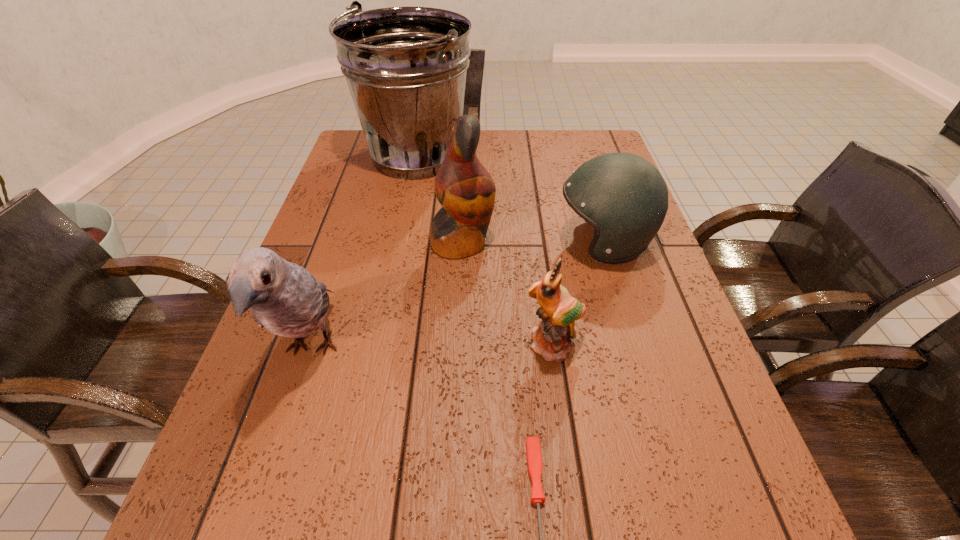
Where is `bucket`? This screenshot has width=960, height=540. bucket is located at coordinates (406, 67).

Identify the location of the tallest object. tap(406, 67).

Locate an element on the screen. The height and width of the screenshot is (540, 960). the farthest parrot is located at coordinates (466, 191).

Where is `the fourth shortest object`? the fourth shortest object is located at coordinates (285, 298).

Find the location of a particular element. the leftmost parrot is located at coordinates (285, 298).

Identify the location of the shortest parrot. This screenshot has height=540, width=960. (558, 310).

Locate an element on the screen. Image resolution: width=960 pixels, height=540 pixels. football helmet is located at coordinates (624, 197).

At what (x,y) coordinates should I click in order to perform the action: click on free spot located on the right of the farthest object. Please return your answer as a coordinate pair (x, y). Looking at the image, I should click on (594, 157).

You are a GUI agent. You are given a task and a screenshot of the screen. Output one action in this format:
    pyautogui.click(x=<x>, y=<y>)
    Task: Click on the vacant space located on the face of the second parrot from left to right
    This screenshot has width=960, height=540.
    Given the screenshot: What is the action you would take?
    pyautogui.click(x=597, y=242)

Locate an element on the screen. Image resolution: width=960 pixels, height=540 pixels. vacant region located on the front-facing side of the leftmost parrot is located at coordinates (251, 532).